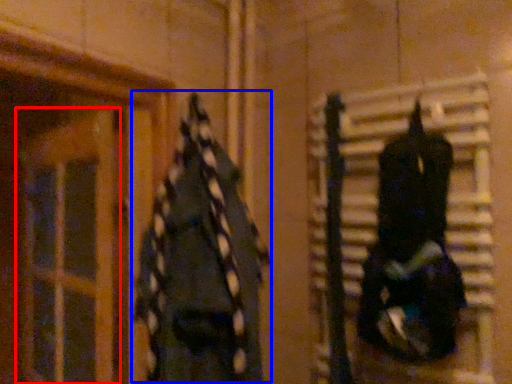
Question: Which of the following is the farthest to the observer, glass door (highlighted by a red box) or clothing (highlighted by a blue box)?

Choices:
 (A) glass door
 (B) clothing

Answer: (A)